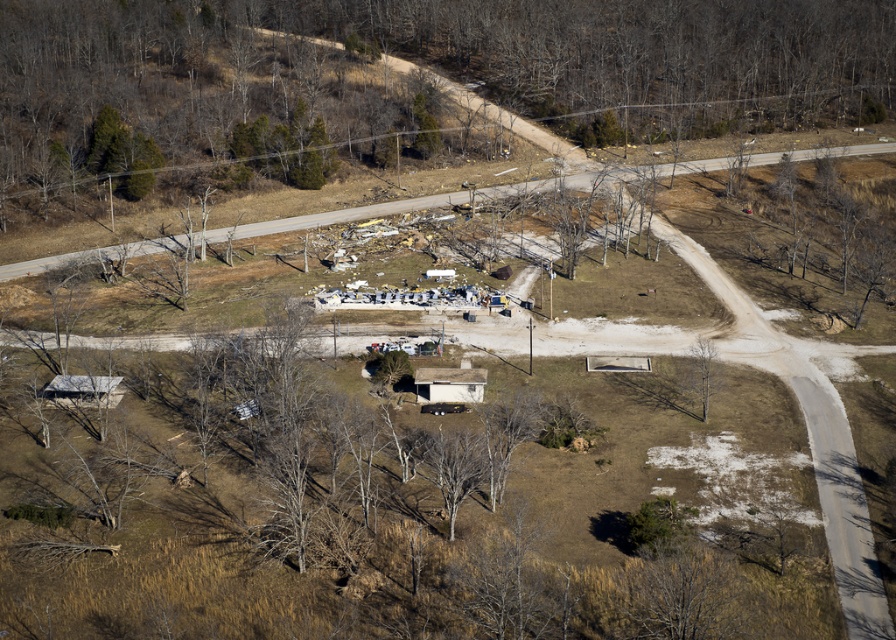
Looking at this image, who is positioned more to the left, bare wood tree at lower right or green leafy tree at center?

green leafy tree at center

Between bare wood tree at lower right and green leafy tree at center, which one is positioned lower?

Positioned lower is bare wood tree at lower right.

Is point (705, 349) positioned in front of point (382, 378)?

No, (705, 349) is behind (382, 378).

This screenshot has width=896, height=640. I want to click on bare wood tree at lower right, so click(x=703, y=371).

Who is positioned more to the left, bare wood tree at center or bare wood tree at lower right?

Positioned to the left is bare wood tree at center.

Who is positioned more to the right, bare wood tree at center or bare wood tree at lower right?

From the viewer's perspective, bare wood tree at lower right appears more on the right side.

The width and height of the screenshot is (896, 640). Describe the element at coordinates (453, 467) in the screenshot. I see `bare wood tree at center` at that location.

Locate an element on the screen. This screenshot has height=640, width=896. bare wood tree at center is located at coordinates (453, 467).

This screenshot has width=896, height=640. I want to click on bare wood tree at center, so click(453, 467).

Does bare wood tree at center have a larger size compared to green leafy tree at center?

Yes, bare wood tree at center is bigger than green leafy tree at center.

Identify the location of bare wood tree at center. This screenshot has height=640, width=896. (453, 467).